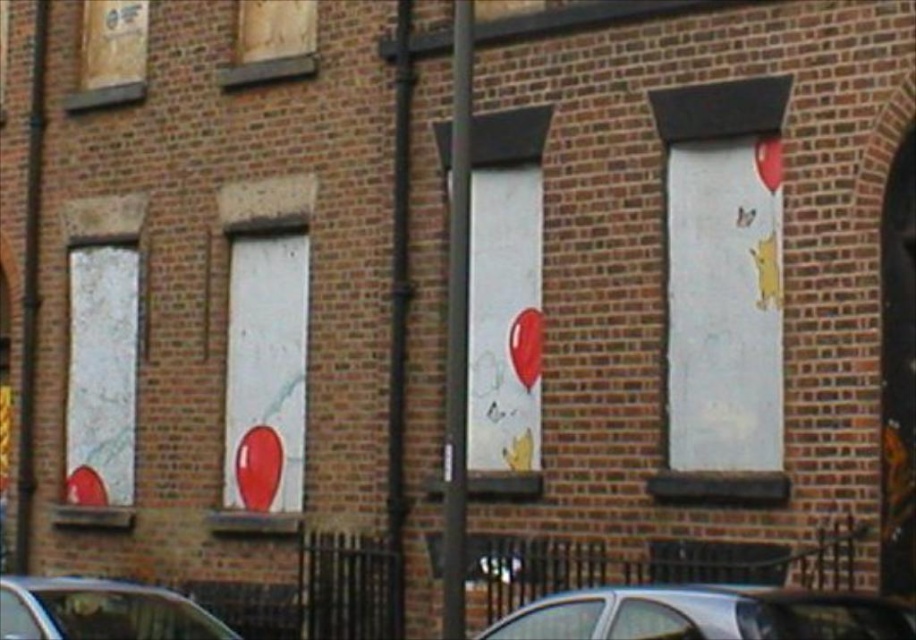
Question: Can you confirm if silver metallic car at lower center is positioned to the right of brushed metal pole at left?

Choices:
 (A) yes
 (B) no

Answer: (A)

Question: Based on their relative distances, which object is farther from the silver metallic car at lower center?

Choices:
 (A) brushed metal pole at left
 (B) metallic silver car at lower left

Answer: (A)

Question: Which of the following is the closest to the observer?

Choices:
 (A) (818, 598)
 (B) (173, 593)
 (C) (448, 518)
 (D) (25, 456)

Answer: (A)

Question: Which of these objects is positioned farthest from the metallic pole at center?

Choices:
 (A) silver metallic car at lower center
 (B) brushed metal pole at left
 (C) metallic silver car at lower left

Answer: (B)

Question: Is metallic silver car at lower left bigger than brushed metal pole at left?

Choices:
 (A) yes
 (B) no

Answer: (A)

Question: Can you confirm if silver metallic car at lower center is thinner than metallic silver car at lower left?

Choices:
 (A) no
 (B) yes

Answer: (A)